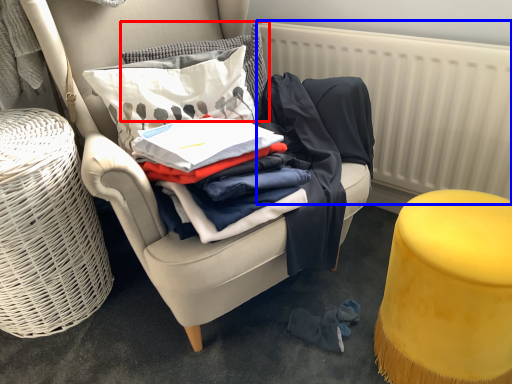
Question: Which of the following is the closest to the observer, pillow (highlighted by a red box) or radiator (highlighted by a blue box)?

Choices:
 (A) pillow
 (B) radiator

Answer: (B)